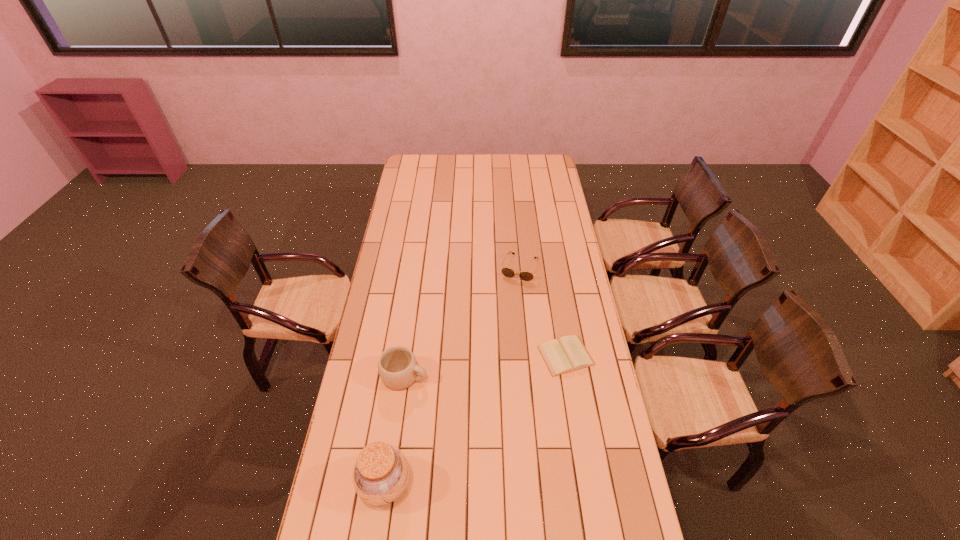
Where is `vacant region between the nearest object and the diary`? The width and height of the screenshot is (960, 540). vacant region between the nearest object and the diary is located at coordinates (475, 420).

At what (x,y) coordinates should I click in order to perform the action: click on free point between the shortest object and the farthest object. Please return your answer as a coordinate pair (x, y). The image size is (960, 540). Looking at the image, I should click on (542, 312).

Identify the location of vacant space that is in between the mug and the diary. (486, 366).

Locate an element on the screen. This screenshot has width=960, height=540. free space between the shortest object and the mug is located at coordinates (486, 366).

Find the location of a particular element. unoccupied position between the jar and the second tallest object is located at coordinates (395, 430).

Locate which object ranks third in proximity to the tallest object. Please provide its 2D coordinates. Your answer should be formatted as a tuple, i.e. [(x, y)], where the tuple contains the x and y coordinates of a point satisfying the conditions above.

[(526, 276)]

Locate an element on the screen. This screenshot has height=540, width=960. the closest object to the sunglasses is located at coordinates (569, 354).

Locate an element on the screen. The image size is (960, 540). blank space that satisfies the following two spatial constraints: 1. on the back side of the nearest object; 2. on the right side of the shortest object is located at coordinates (404, 356).

This screenshot has width=960, height=540. Identify the location of free space in the image that satisfies the following two spatial constraints: 1. on the back side of the third shortest object; 2. on the right side of the jar. (401, 376).